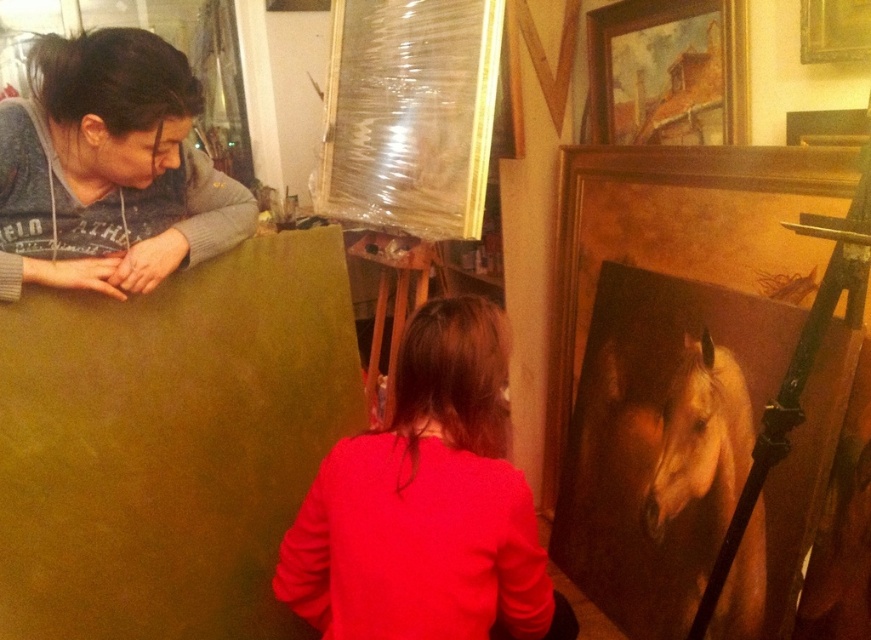
You are a photographer standing in front of the camera. You want to take a closeup photo of the matte red sweater at center. The camera has a minimum focusing distance of 1 meter. Can you take the photo without moving the sweater or the camera?

The matte red sweater at center is 1.17 meters away from the camera. Since the minimum focusing distance is 1 meter, the camera can focus on the matte red sweater at center because 1.17 meters is beyond the minimum distance required.

You are an art student who wants to join the group in the studio. You see the matte red sweater at center and the matte gray hoodie at upper left. Which person should you approach first to ask for guidance?

You should approach the matte red sweater at center first because they are closer to you than the matte gray hoodie at upper left, making them easier to reach.